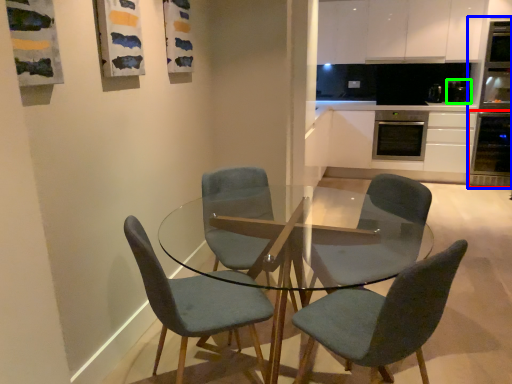
Question: Estimate the real-world distances between objects in this image. Which object is farther from oven (highlighted by a red box), appliance (highlighted by a blue box) or appliance (highlighted by a green box)?

Choices:
 (A) appliance
 (B) appliance

Answer: (B)